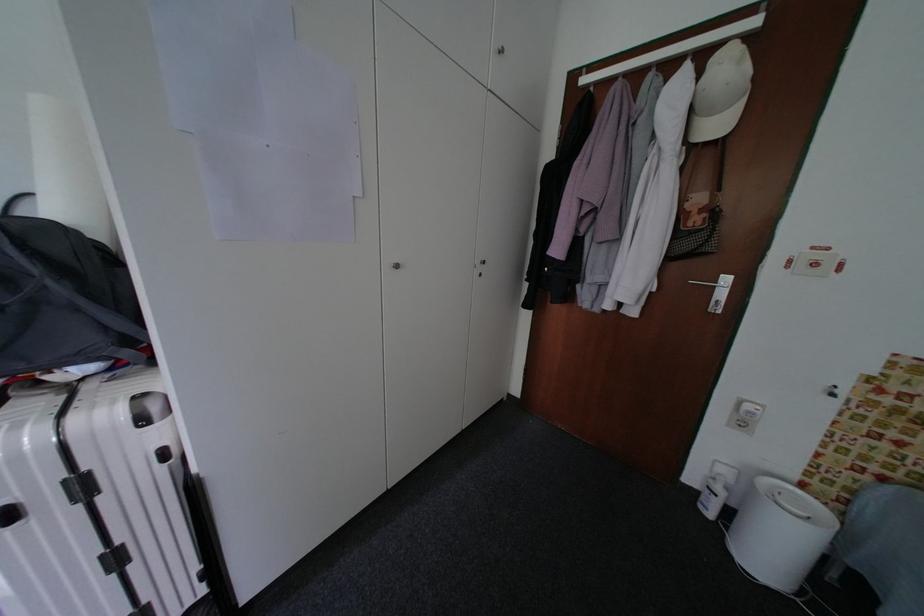
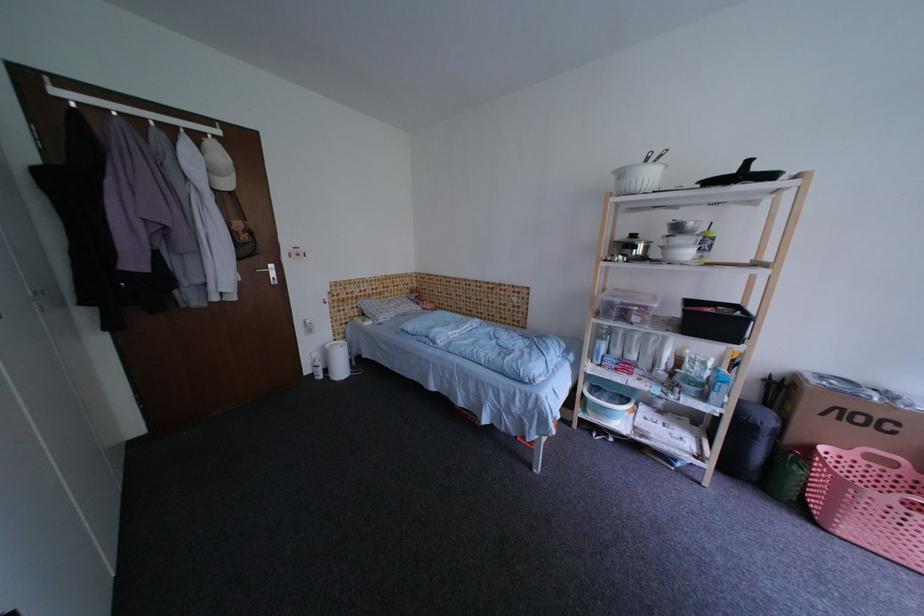
The point at [727,493] is marked in the first image. Where is the corresponding point in the second image?

(326, 366)